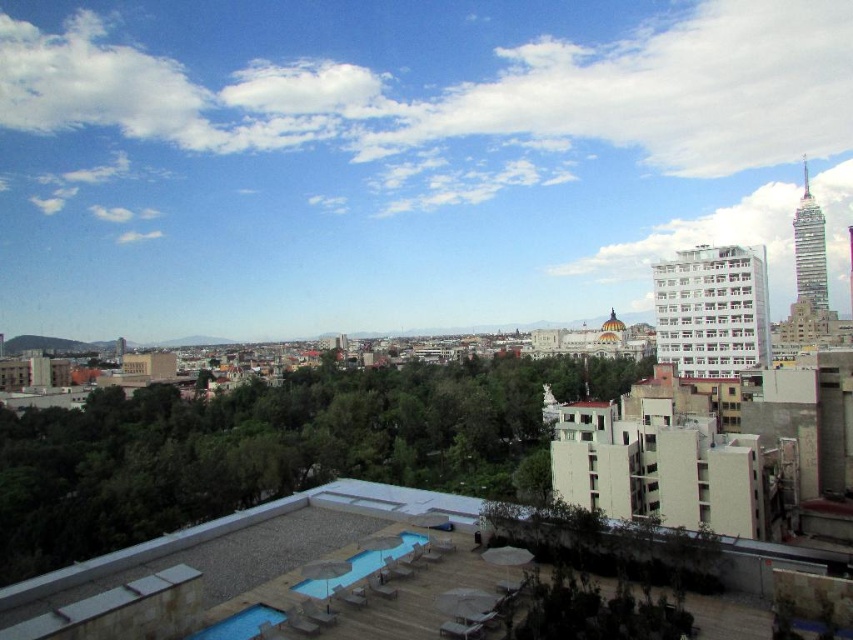
Who is positioned more to the right, blue smooth pool at lower center or blue smooth pool at lower left?

blue smooth pool at lower center

Which is in front, point (316, 593) or point (231, 616)?

Point (231, 616) is in front.

This screenshot has height=640, width=853. I want to click on blue smooth pool at lower center, so click(x=361, y=564).